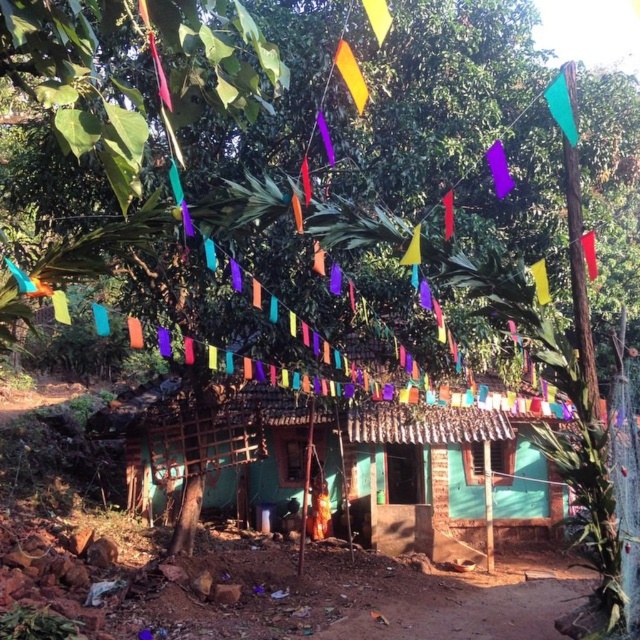
You are planning to hang a new flag on the house. The yellow fabric flag at upper center and the red fabric flag at upper center are currently displayed. Which flag has a smaller width?

The yellow fabric flag at upper center has a lesser width compared to the red fabric flag at upper center.

You are standing in front of the house and notice two flags flying above it. Which flag, the yellow fabric flag at upper center or the orange fabric flag at upper center, is closer to you?

The yellow fabric flag at upper center is closer to you because it is in front of the orange fabric flag at upper center.

You are standing in front of the house and notice two flags, the yellow fabric flag at upper center and the red fabric flag at upper center. Which flag is positioned closer to you?

The yellow fabric flag at upper center is closer to the viewer than the red fabric flag at upper center.